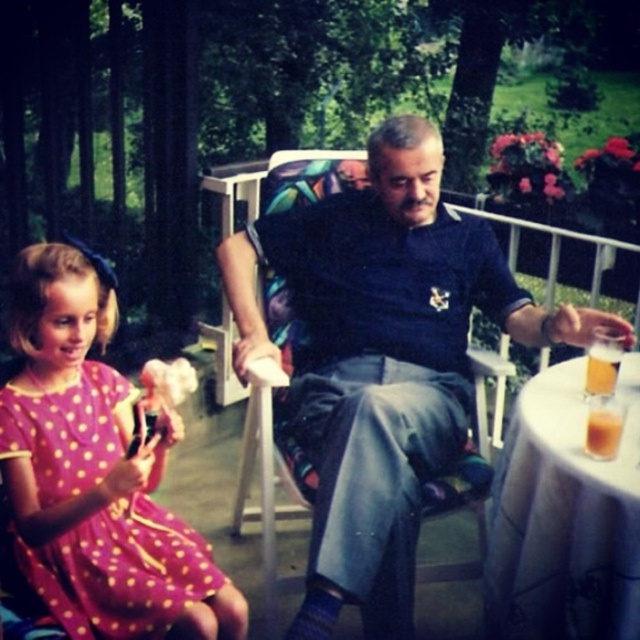
You are planning to place a small plant between the multicolored fabric chair at center and the translucent glass beverage at table right. Which object should the plant be closer to if you want it nearer to the chair?

The plant should be placed closer to the multicolored fabric chair at center since it is positioned to the left of the translucent glass beverage at table right, so placing it closer to the chair would mean it is nearer to the chair.